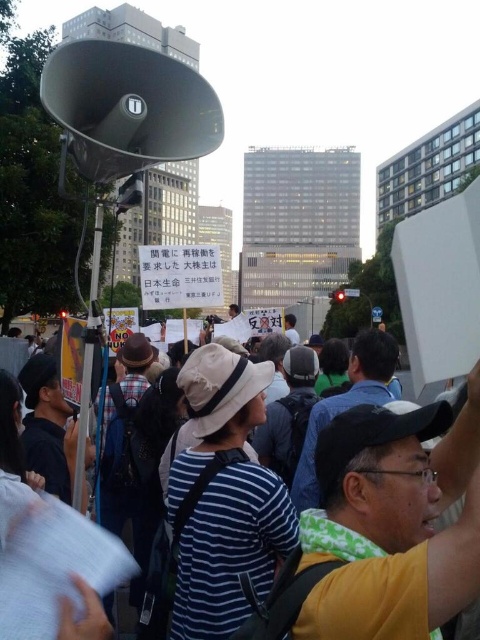
Question: Which point appears farthest from the camera in this image?

Choices:
 (A) (108, 634)
 (B) (204, 134)

Answer: (B)

Question: Does striped fabric crowd at lower center have a smaller size compared to matte gray megaphone at upper left?

Choices:
 (A) no
 (B) yes

Answer: (A)

Question: Is striped fabric crowd at lower center to the right of matte gray megaphone at upper left from the viewer's perspective?

Choices:
 (A) no
 (B) yes

Answer: (B)

Question: Which point is farther from the camera taking this photo?

Choices:
 (A) (433, 561)
 (B) (113, 52)

Answer: (B)

Question: Does striped fabric crowd at lower center have a smaller size compared to matte gray megaphone at upper left?

Choices:
 (A) no
 (B) yes

Answer: (A)